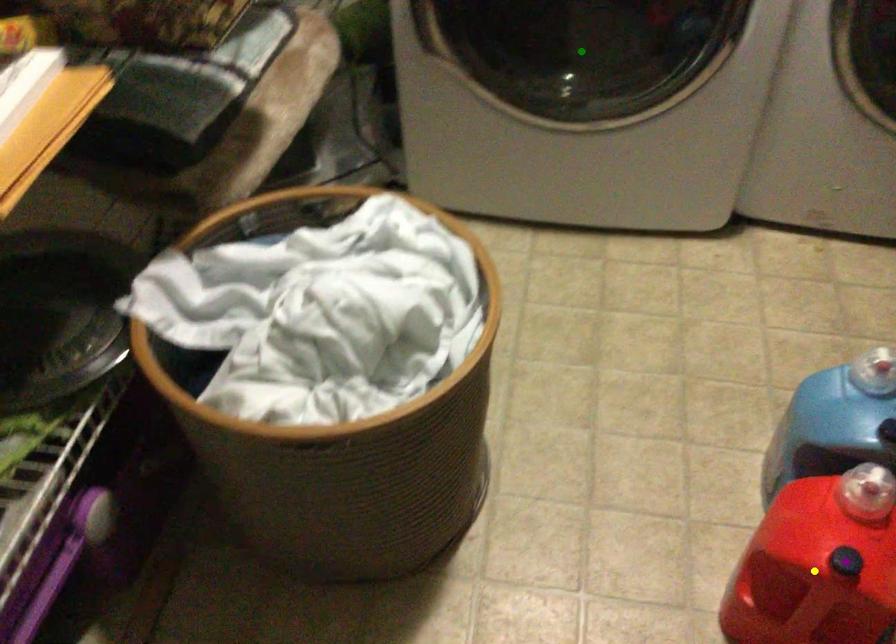
Order these from nearest to farthest:
A) purple point
B) green point
C) yellow point

1. green point
2. yellow point
3. purple point